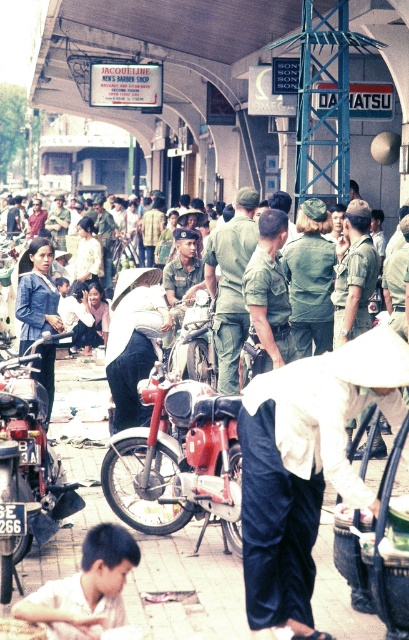
Question: Is white cotton hat at center positioned behind green military uniform at center?

Choices:
 (A) no
 (B) yes

Answer: (A)

Question: Is shiny chrome motorcycle at lower left thinner than green uniform at center?

Choices:
 (A) yes
 (B) no

Answer: (B)

Question: Is green uniform at center wider than green matte uniform at center?

Choices:
 (A) yes
 (B) no

Answer: (A)

Question: Which object is positioned farthest from the green uniform at center?

Choices:
 (A) green matte uniform at center
 (B) shiny chrome motorcycle at lower left
 (C) green military uniform at center
 (D) white cotton hat at center

Answer: (D)

Question: Which object is closer to the camera taking this photo?

Choices:
 (A) green matte uniform at center
 (B) white cotton hat at center

Answer: (B)

Question: Which of the following is the farthest from the observer?

Choices:
 (A) (222, 284)
 (B) (287, 340)

Answer: (A)